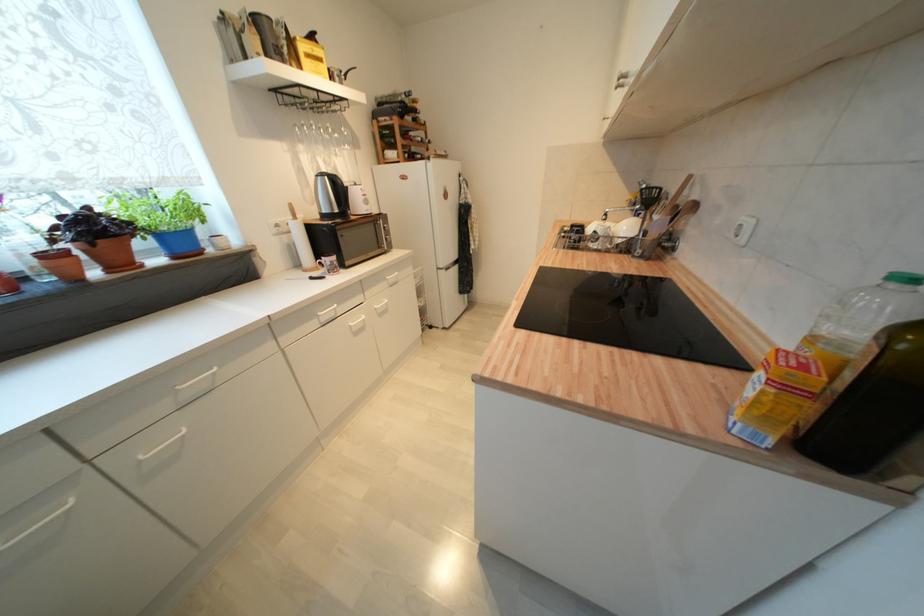
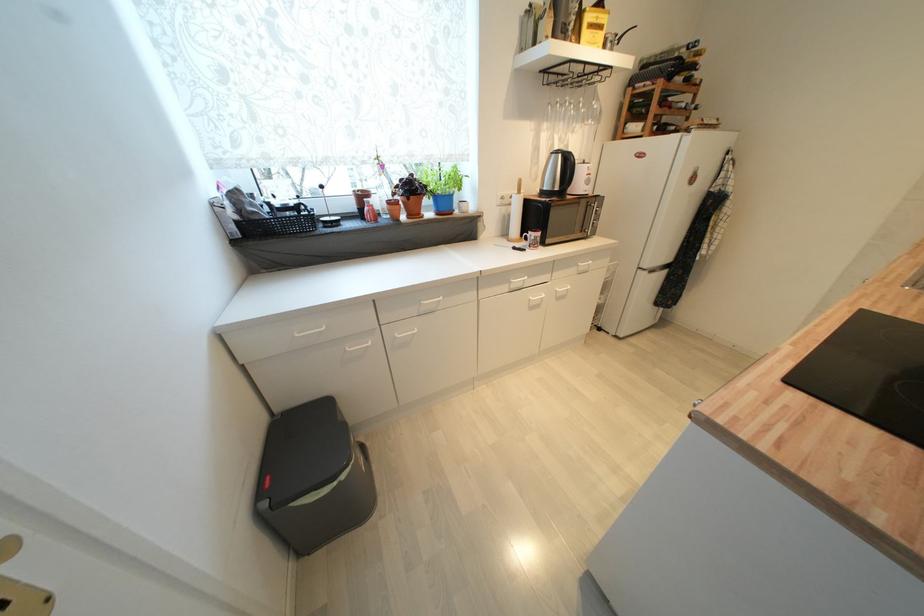
The point at (334,137) is marked in the first image. Where is the corresponding point in the second image?

(582, 111)